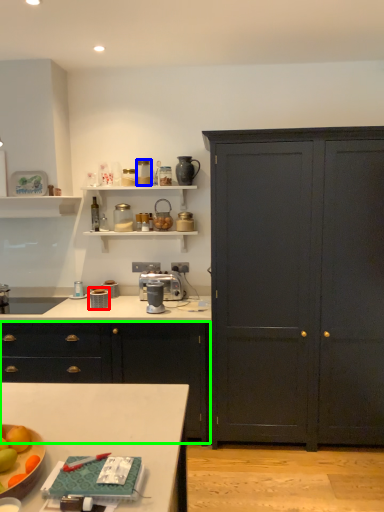
Question: Which is farther away from appliance (highlighted by a red box)? appliance (highlighted by a blue box) or cabinetry (highlighted by a green box)?

Choices:
 (A) appliance
 (B) cabinetry

Answer: (A)